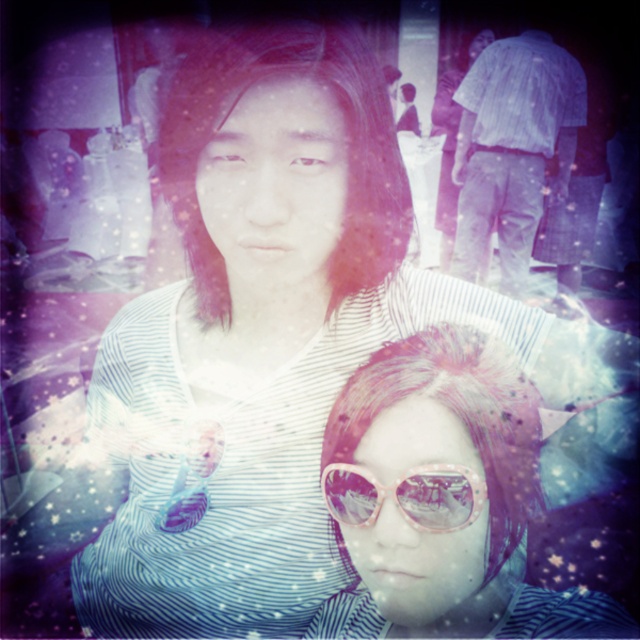
Can you confirm if light blue striped shirt at upper right is positioned above pink shiny sunglasses at center?

Correct, light blue striped shirt at upper right is located above pink shiny sunglasses at center.

Does light blue striped shirt at upper right have a smaller size compared to pink shiny sunglasses at center?

Actually, light blue striped shirt at upper right might be larger than pink shiny sunglasses at center.

Locate an element on the screen. The width and height of the screenshot is (640, 640). light blue striped shirt at upper right is located at coordinates (513, 148).

Where is `light blue striped shirt at upper right`? This screenshot has width=640, height=640. light blue striped shirt at upper right is located at coordinates (513, 148).

Can you confirm if pink plastic sunglasses at center is smaller than pink shiny sunglasses at center?

No.

Which is above, pink plastic sunglasses at center or pink shiny sunglasses at center?

pink shiny sunglasses at center is above.

The height and width of the screenshot is (640, 640). What are the coordinates of `pink plastic sunglasses at center` in the screenshot? It's located at (442, 499).

Does pink plastic sunglasses at center have a greater height compared to light blue striped shirt at upper right?

In fact, pink plastic sunglasses at center may be shorter than light blue striped shirt at upper right.

Image resolution: width=640 pixels, height=640 pixels. Identify the location of pink plastic sunglasses at center. (442, 499).